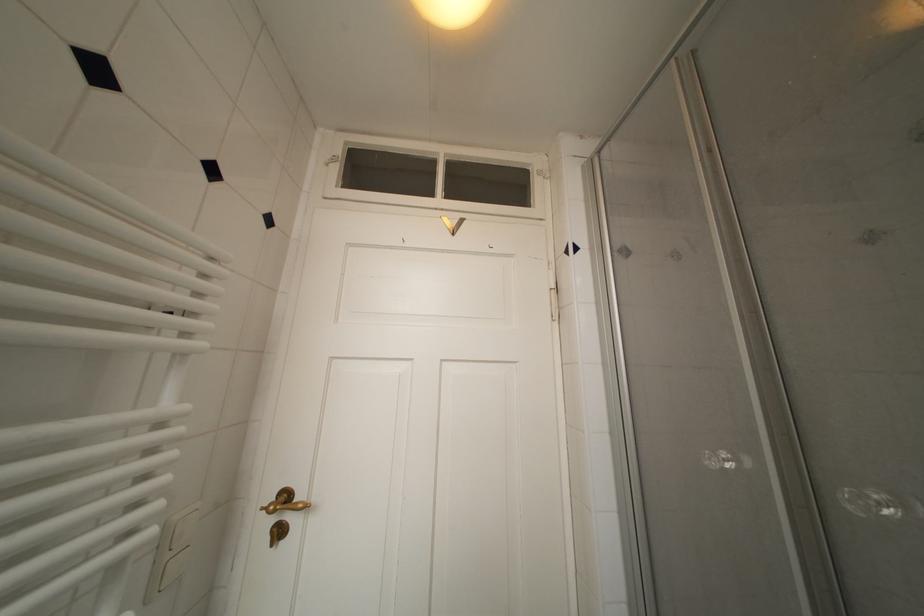
This screenshot has width=924, height=616. Identify the location of brass door handle. (285, 501).